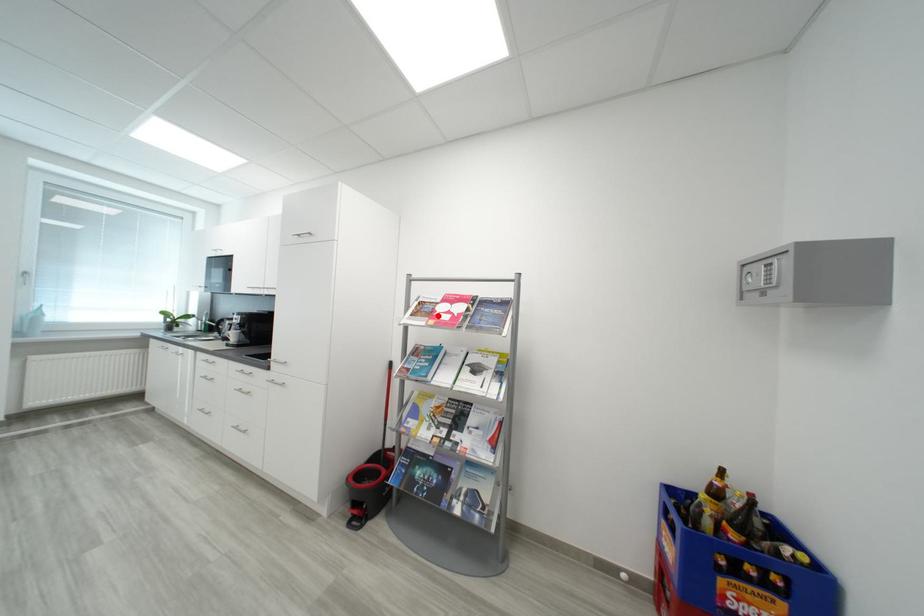
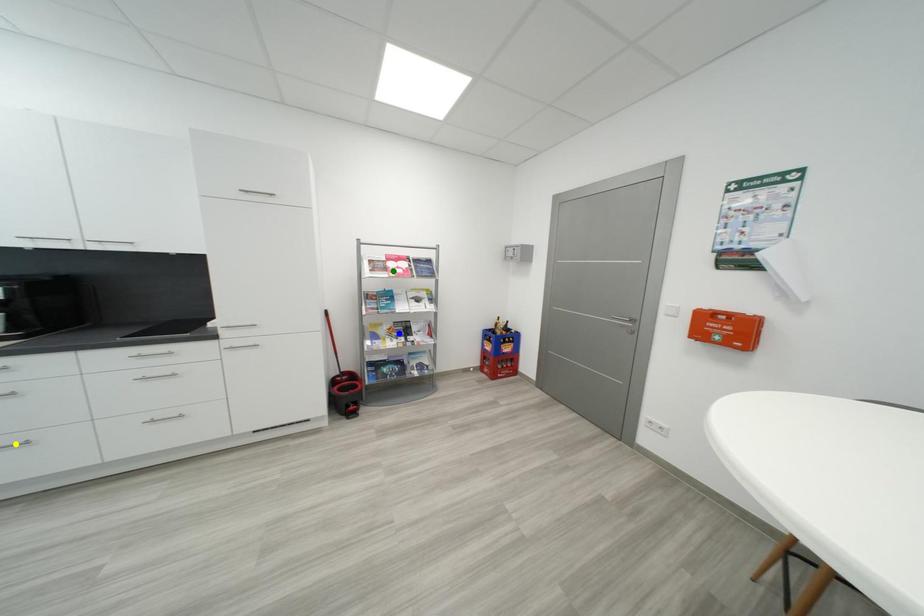
Question: I am providing you with two images of the same scene from different viewpoints. A red point is marked on the first image. You are given multiple points on the second image. Which spot in image 2 lines up with the point in image 1?

Choices:
 (A) blue point
 (B) green point
 (C) yellow point

Answer: (B)